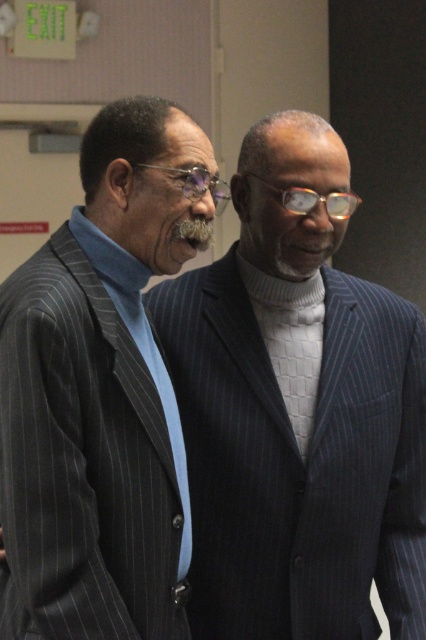
Question: Can you confirm if dark blue pinstripe suit at center is positioned to the right of clear plastic glasses at center?

Choices:
 (A) yes
 (B) no

Answer: (B)

Question: Can you confirm if pinstriped suit at left is bigger than clear plastic glasses at center?

Choices:
 (A) no
 (B) yes

Answer: (B)

Question: Is dark blue pinstripe suit at center bigger than pinstriped suit at left?

Choices:
 (A) yes
 (B) no

Answer: (A)

Question: Which object is positioned closest to the dark blue pinstripe suit at center?

Choices:
 (A) pinstriped suit at left
 (B) clear plastic glasses at center

Answer: (A)

Question: Among these points, which one is nearest to the camera?

Choices:
 (A) (391, 481)
 (B) (293, 198)
 (C) (127, 211)

Answer: (C)

Question: Considering the real-world distances, which object is farthest from the dark blue pinstripe suit at center?

Choices:
 (A) pinstriped suit at left
 (B) clear plastic glasses at center

Answer: (B)